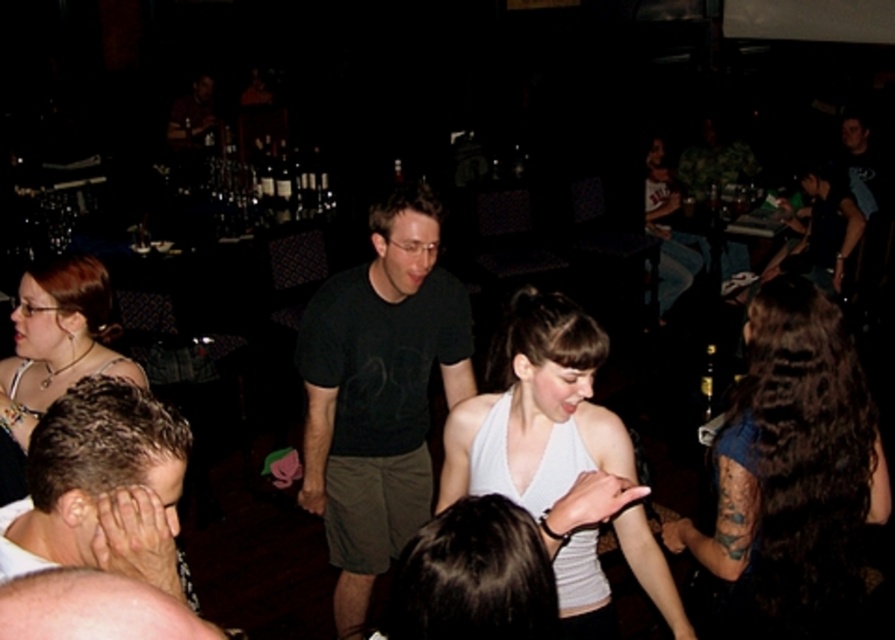
Question: Which of these objects is positioned closest to the white matte hair at lower left?

Choices:
 (A) matte black necklace at left
 (B) dark brown hair at lower right
 (C) white matte tank top at center

Answer: (C)

Question: Based on their relative distances, which object is farther from the white matte tank top at center?

Choices:
 (A) matte black necklace at left
 (B) black matte t-shirt at center
 (C) smooth skin head at lower left
 (D) dark brown hair at lower right

Answer: (A)

Question: Considering the real-world distances, which object is farthest from the dark brown hair at lower right?

Choices:
 (A) white matte hair at lower left
 (B) black matte t-shirt at center
 (C) matte black necklace at left
 (D) smooth skin head at lower left

Answer: (C)

Question: Does black matte t-shirt at center have a larger size compared to smooth skin head at lower left?

Choices:
 (A) no
 (B) yes

Answer: (B)

Question: Is dark brown hair at lower right bigger than matte black necklace at left?

Choices:
 (A) yes
 (B) no

Answer: (B)

Question: Can you confirm if white matte tank top at center is positioned to the left of smooth skin head at lower left?

Choices:
 (A) no
 (B) yes

Answer: (A)